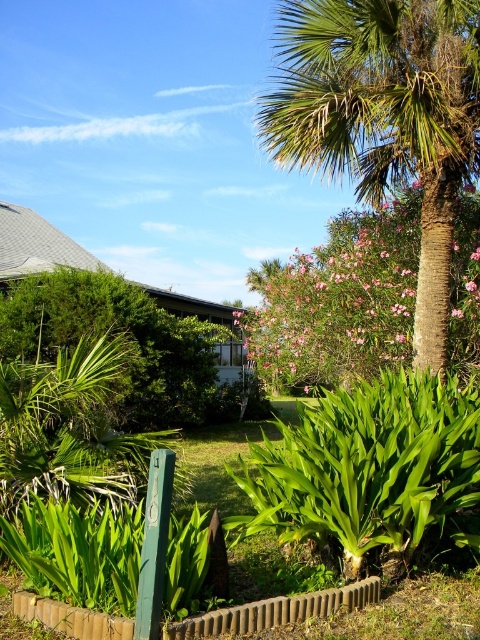
Question: Which is farther from the green leafy bush at center?

Choices:
 (A) brick fence at lower center
 (B) green textured palm tree at upper right

Answer: (A)

Question: Which point is farther to the camera?

Choices:
 (A) (190, 371)
 (B) (343, 124)

Answer: (A)

Question: Which object appears farthest from the camera in this image?

Choices:
 (A) green leafy bush at center
 (B) brick fence at lower center

Answer: (A)

Question: Does green leafy bush at center appear on the right side of brick fence at lower center?

Choices:
 (A) yes
 (B) no

Answer: (B)

Question: Is green textured palm tree at upper right bigger than green leafy bush at center?

Choices:
 (A) yes
 (B) no

Answer: (A)

Question: Can you confirm if green leafy bush at center is positioned to the left of brick fence at lower center?

Choices:
 (A) yes
 (B) no

Answer: (A)